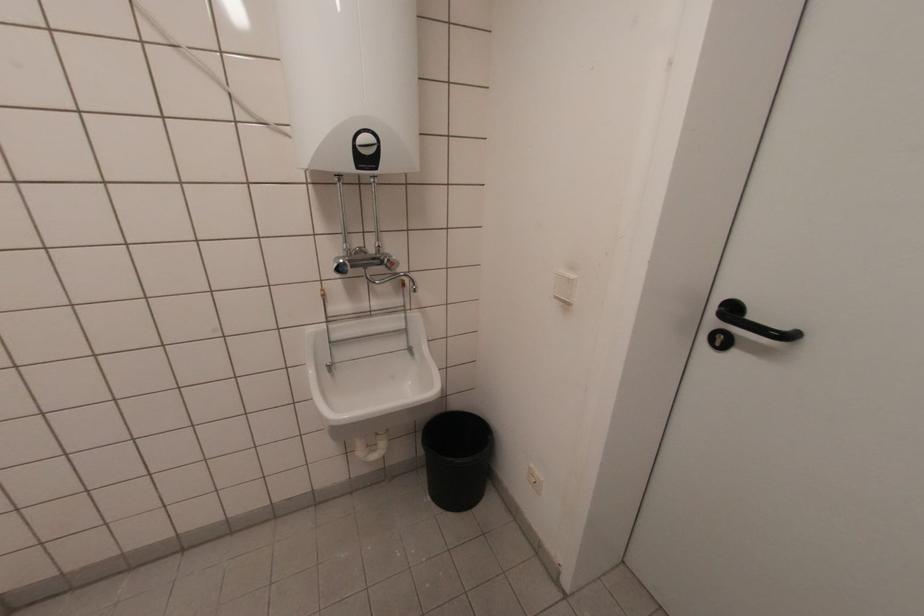
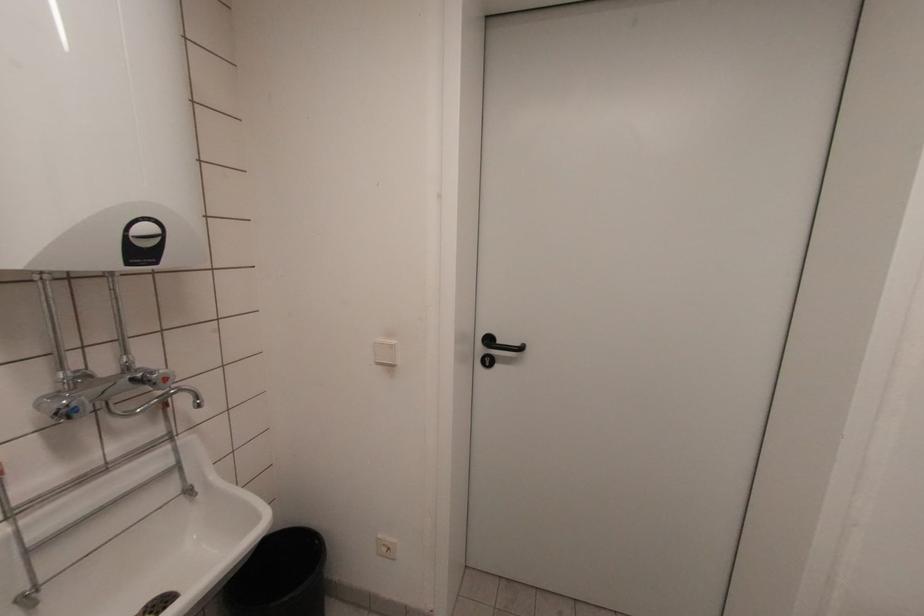
The point at (x=490, y=438) is marked in the first image. Where is the corresponding point in the second image?

(317, 543)